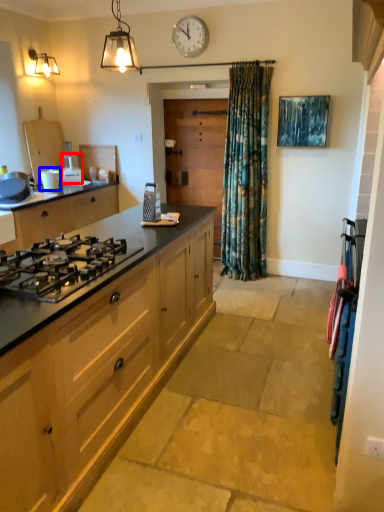
Question: Which object appears closest to the camera in this image, appliance (highlighted by a red box) or appliance (highlighted by a blue box)?

Choices:
 (A) appliance
 (B) appliance

Answer: (B)